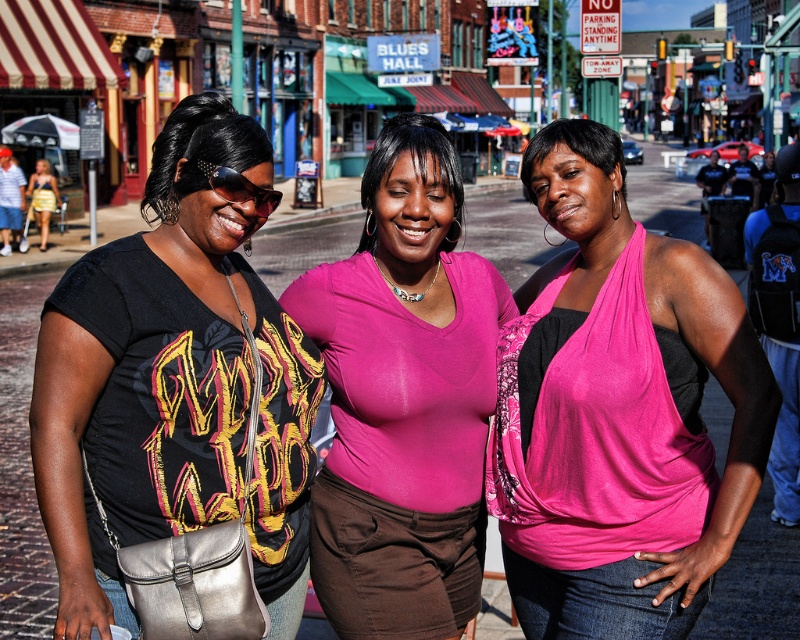
You are standing at a point in the street scene. You want to know how far you are from the point marked as point [508,576]. Can you determine the distance?

The distance between you and point [508,576] is 7.53 meters.

You are taking a photo of the three women in the street scene. You want to focus on the point at coordinates point (192, 355) and point (368, 211). Which point is closer to the camera?

Point (192, 355) is closer to the camera than point (368, 211).